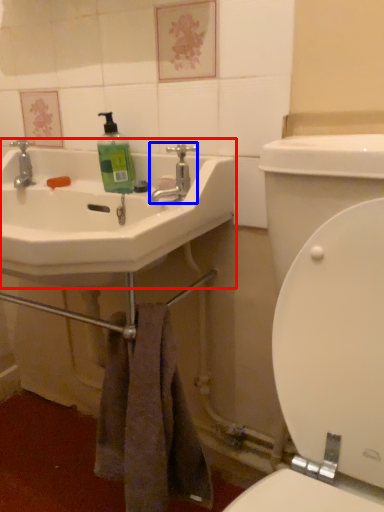
Question: Among these objects, which one is nearest to the camera, sink (highlighted by a red box) or tap (highlighted by a blue box)?

Choices:
 (A) sink
 (B) tap

Answer: (A)